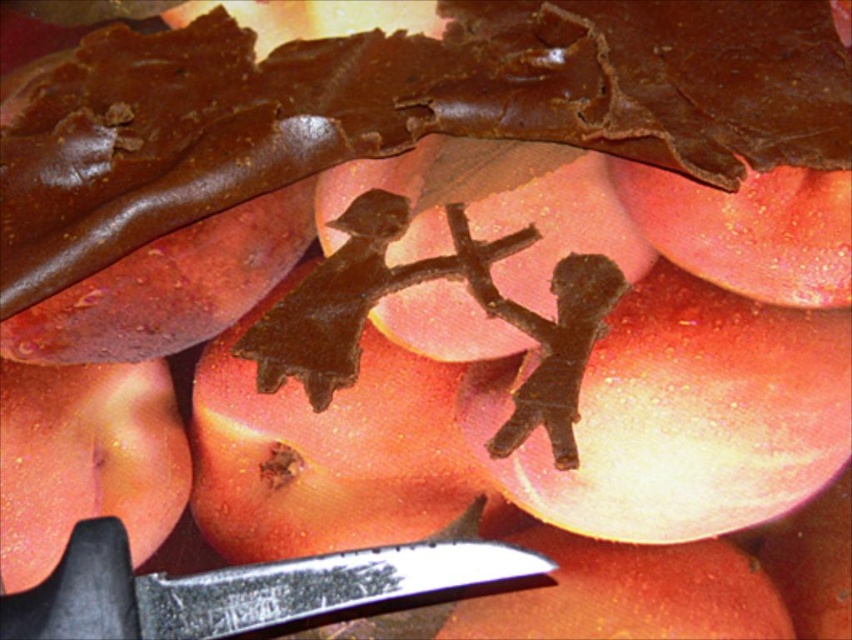
Question: Does matte chocolate figure at center appear over smooth brown chocolate at center?

Choices:
 (A) yes
 (B) no

Answer: (A)

Question: Can you confirm if matte chocolate figure at center is positioned to the left of metallic silver knife at lower left?

Choices:
 (A) yes
 (B) no

Answer: (B)

Question: Which of these objects is positioned closest to the metallic silver knife at lower left?

Choices:
 (A) smooth brown chocolate at center
 (B) matte chocolate figure at center
 (C) smooth red apple at lower left

Answer: (A)

Question: Is smooth dark brown chocolate cake at center to the right of matte chocolate figure at center from the viewer's perspective?

Choices:
 (A) yes
 (B) no

Answer: (B)

Question: Which of the following is the farthest from the observer?

Choices:
 (A) 337,524
 (B) 93,480

Answer: (B)

Question: Which is nearer to the matte chocolate figure at center?

Choices:
 (A) metallic silver knife at lower left
 (B) smooth dark brown chocolate cake at center
 (C) smooth brown chocolate at center
 (D) smooth red apple at lower left

Answer: (C)